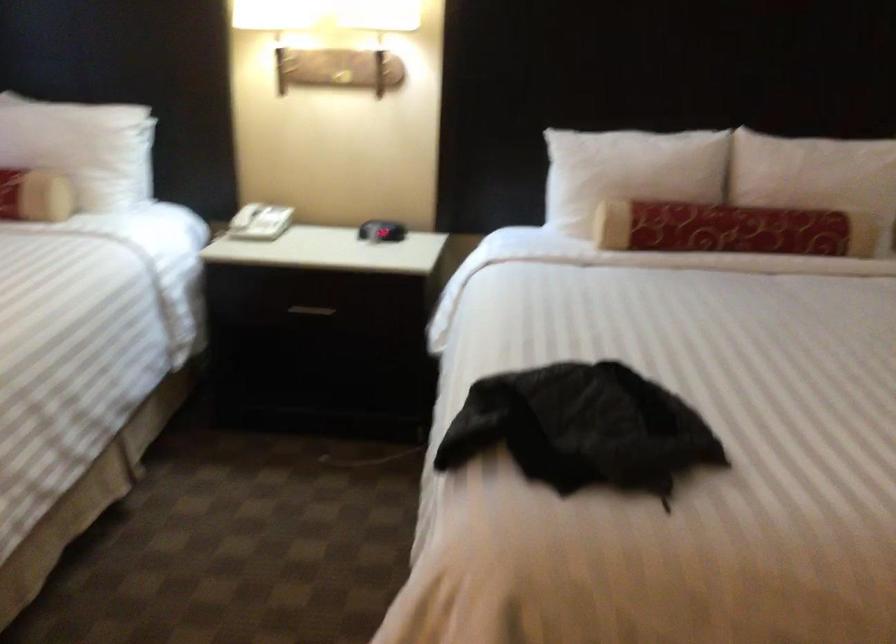
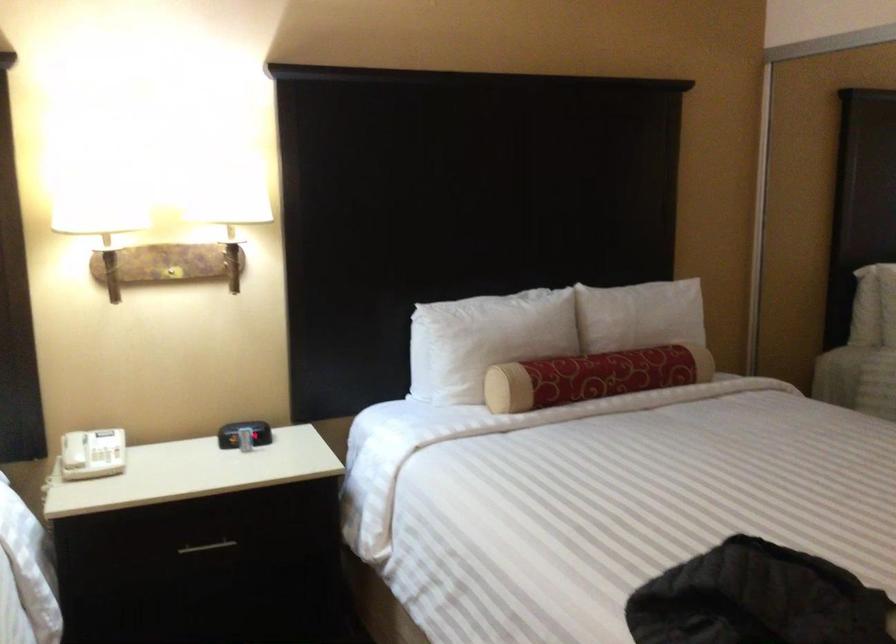
Locate, in the second image, the point that corresponds to [314,308] in the first image.

(207, 547)